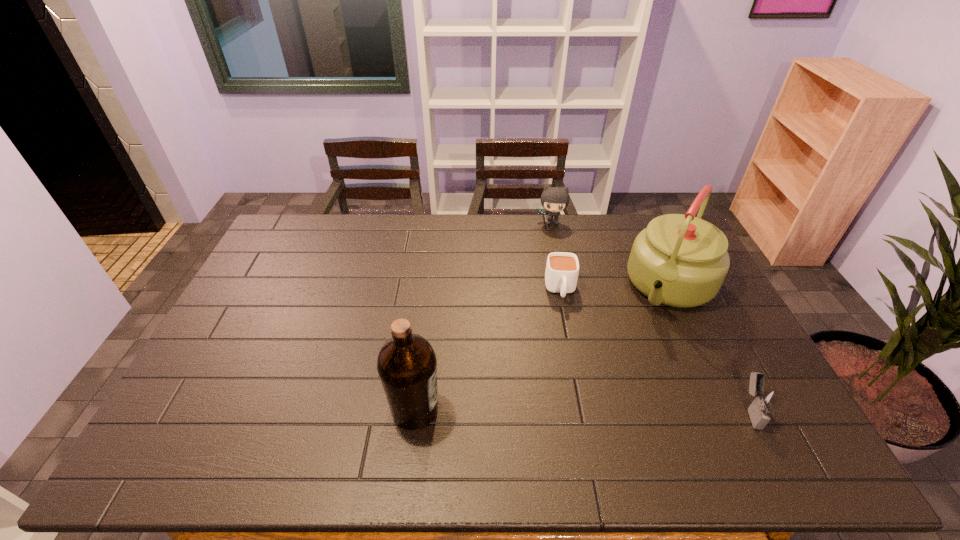
The image size is (960, 540). Identify the location of igniter at the right edge. (765, 400).

This screenshot has height=540, width=960. Find the location of `kettle located at the right edge`. kettle located at the right edge is located at coordinates (679, 260).

I want to click on object positioned at the near right corner, so click(765, 400).

You are a GUI agent. You are given a task and a screenshot of the screen. Output one action in this format:
    pyautogui.click(x=<x>, y=<y>)
    Task: Click on the vacant region at the far edge of the desktop
    The width and height of the screenshot is (960, 540).
    Given the screenshot: What is the action you would take?
    435,240

Where is `vacant space at the near edge of the desktop`? vacant space at the near edge of the desktop is located at coordinates (559, 413).

In the image, there is a desktop. At what (x,y) coordinates should I click in order to perform the action: click on vacant region at the left edge. Please return your answer as a coordinate pair (x, y). The width and height of the screenshot is (960, 540). Looking at the image, I should click on (281, 259).

The height and width of the screenshot is (540, 960). Identify the location of vacant region at the right edge of the desktop. (750, 350).

What are the coordinates of `vacant space at the far left corner` in the screenshot? It's located at (321, 226).

The height and width of the screenshot is (540, 960). I want to click on free space at the near right corner of the desktop, so click(741, 416).

Where is `vacant area that lies between the kettle and the farthest object`? This screenshot has width=960, height=540. vacant area that lies between the kettle and the farthest object is located at coordinates (612, 254).